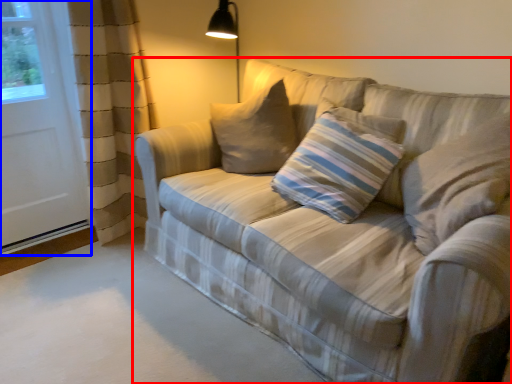
Question: Which point is closer to the camera, studio couch (highlighted by a red box) or screen door (highlighted by a blue box)?

Choices:
 (A) studio couch
 (B) screen door

Answer: (A)